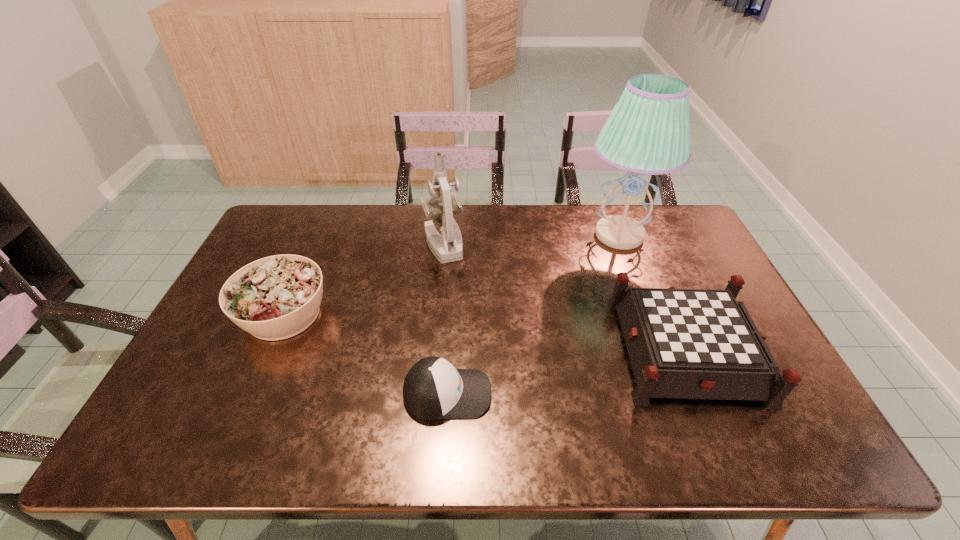
Find the location of a particular element. lamp located in the far edge section of the desktop is located at coordinates (648, 132).

The height and width of the screenshot is (540, 960). What are the coordinates of `microscope that is positioned at the far edge` in the screenshot? It's located at (448, 247).

Image resolution: width=960 pixels, height=540 pixels. In order to click on object positioned at the near edge in this screenshot , I will do `click(433, 389)`.

I want to click on object at the left edge, so click(277, 297).

Locate an element on the screen. lamp that is positioned at the right edge is located at coordinates 648,132.

This screenshot has height=540, width=960. Identify the location of checkerboard at the right edge. (682, 343).

Where is `object located in the far right corner section of the desktop`? The width and height of the screenshot is (960, 540). object located in the far right corner section of the desktop is located at coordinates (648, 132).

The image size is (960, 540). Identify the location of free space at the far edge of the desktop. (512, 230).

The height and width of the screenshot is (540, 960). I want to click on vacant space at the near edge of the desktop, so pyautogui.click(x=638, y=443).

Locate an element on the screen. blank area at the left edge is located at coordinates (197, 347).